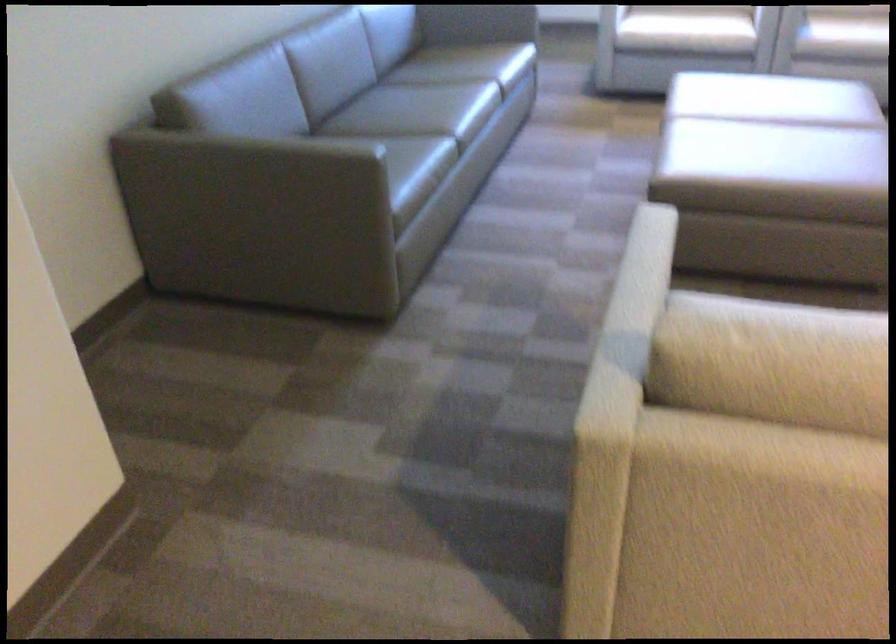
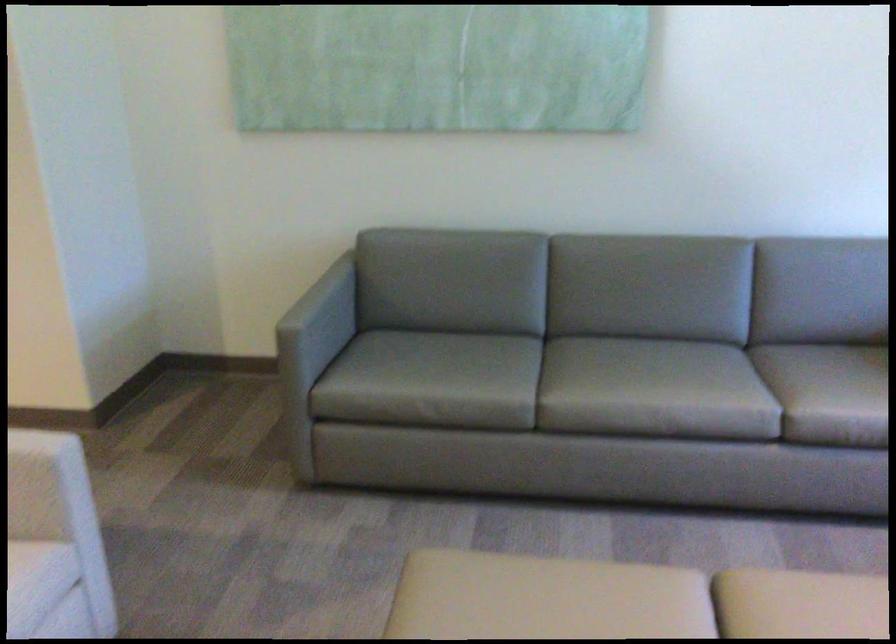
Where in the second image is the point corresponding to (268,167) from the first image?

(321, 313)